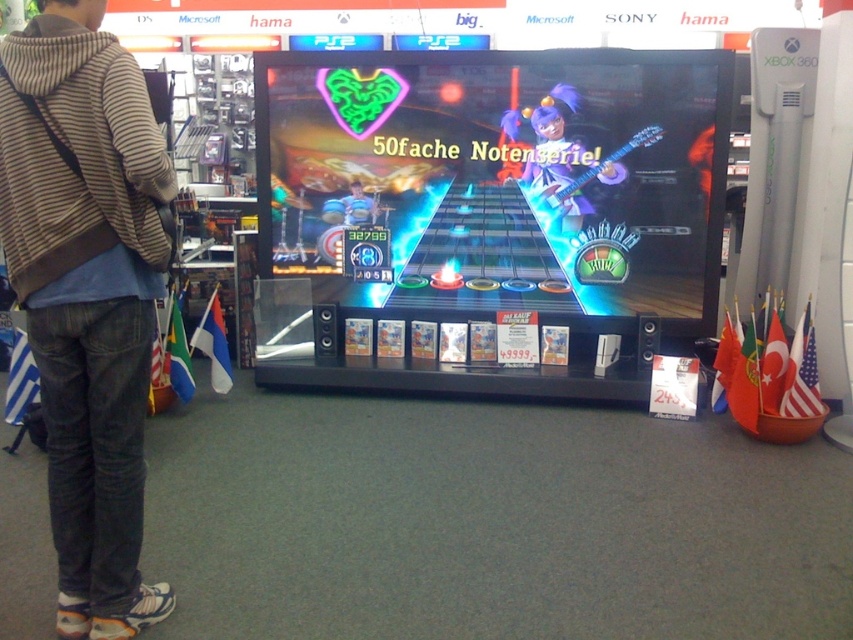
You are a customer in a video game store and see the Rock Band promotional advertisement. There is a point marked at coordinates (560, 161). What color is the hair at that point?

The point at coordinates (560, 161) marks purple hair at center.

Based on the photo, you are a customer in the store and want to place both the shiny plastic guitar at center and the striped hoodie at center on a shelf that is 1 meter wide. Can both items fit side by side on the shelf?

The shiny plastic guitar at center might be wider than striped hoodie at center, so it is uncertain if both can fit on the 1 meter shelf without overlapping. Measure both items to confirm their combined width.